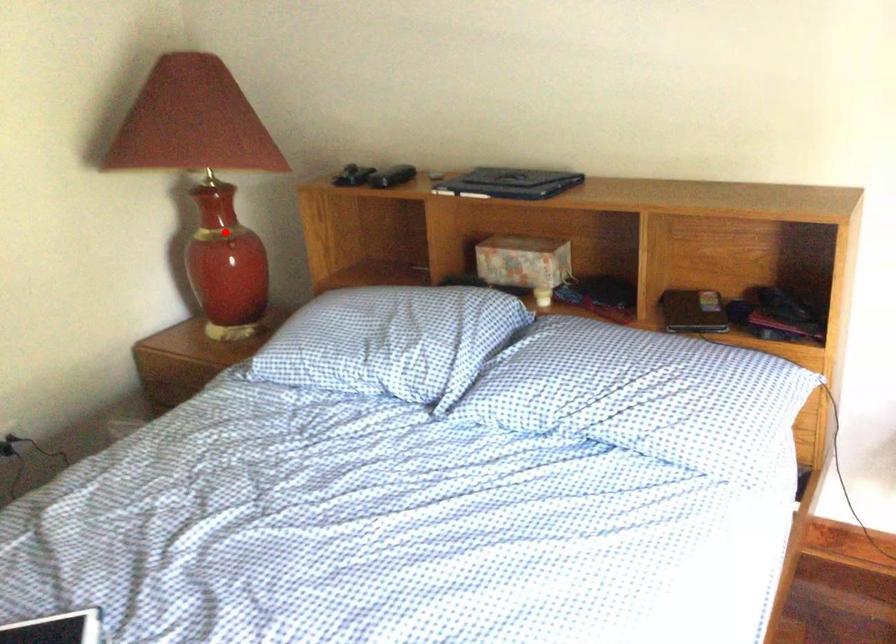
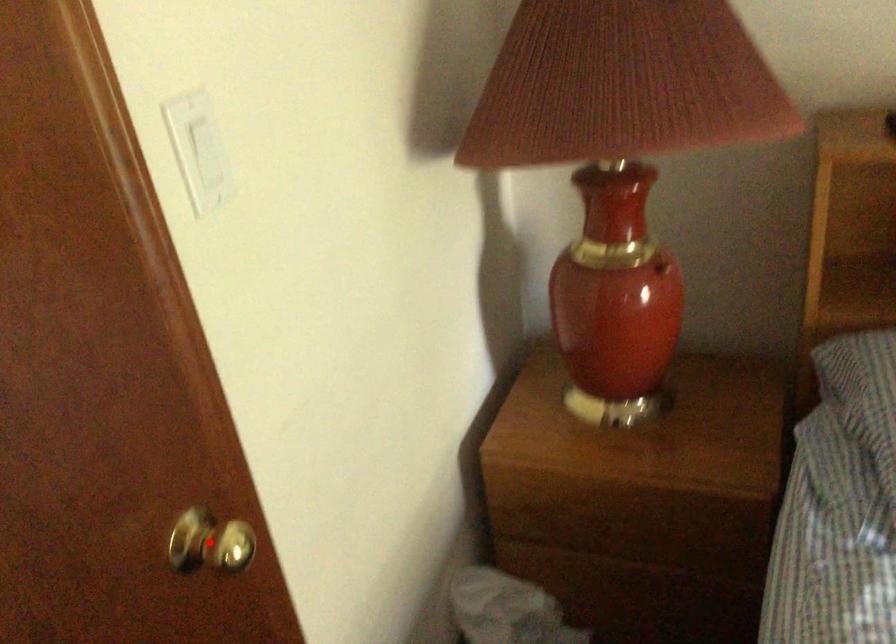
I am providing you with two images of the same scene from different viewpoints. A red point is marked on the first image and another point is marked on the second image. Is the red point in image1 aligned with the point shown in image2?

No